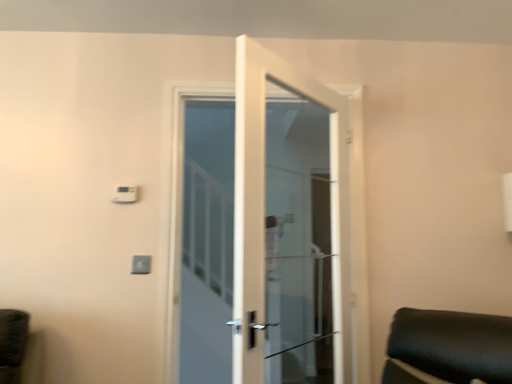
Question: Would you say white plastic light switch at upper center, which is the 1th light switch from bottom to top, is inside or outside white plastic light switch at upper center, positioned as the first light switch in left-to-right order?

Choices:
 (A) inside
 (B) outside

Answer: (B)

Question: From a real-world perspective, is white plastic light switch at upper center, the 2th light switch in the top-to-bottom sequence, above or below white plastic light switch at upper center, which appears as the 1th light switch when viewed from the top?

Choices:
 (A) below
 (B) above

Answer: (A)

Question: Which is nearer to the white plastic light switch at upper center, which appears as the second light switch when viewed from the left?

Choices:
 (A) white plastic light switch at upper center, which ranks as the second light switch in right-to-left order
 (B) white glass door at center

Answer: (A)

Question: Based on their relative distances, which object is farther from the white glass door at center?

Choices:
 (A) white plastic light switch at upper center, acting as the 1th light switch starting from the right
 (B) white plastic light switch at upper center, positioned as the first light switch in left-to-right order

Answer: (B)